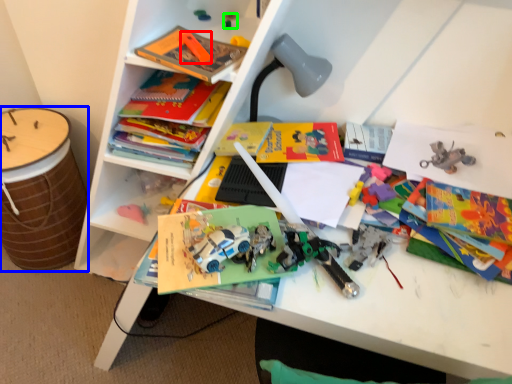
Question: Which object is the farthest from toy (highlighted by a red box)? Choose among these: drum (highlighted by a blue box) or toy (highlighted by a green box).

Choices:
 (A) drum
 (B) toy

Answer: (A)